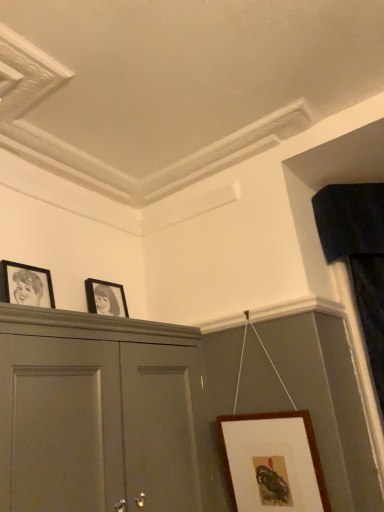
Question: From the image's perspective, relative to brown wooden picture frame at lower right, which is the first picture frame in right-to-left order, is matte gray cabinet at upper left above or below?

Choices:
 (A) below
 (B) above

Answer: (B)

Question: In terms of width, does matte gray cabinet at upper left look wider or thinner when compared to brown wooden picture frame at lower right, the third picture frame when ordered from top to bottom?

Choices:
 (A) wide
 (B) thin

Answer: (A)

Question: Considering the real-world distances, which object is closest to the brown wooden picture frame at lower right, which is the first picture frame in right-to-left order?

Choices:
 (A) matte gray cabinet at upper left
 (B) black matte picture frame at left, placed as the 3th picture frame when sorted from right to left
 (C) velvet dark blue curtain at right
 (D) matte black picture frame at upper center, which is the 2th picture frame in bottom-to-top order

Answer: (A)

Question: Which is nearer to the matte black picture frame at upper center, the second picture frame from the top?

Choices:
 (A) brown wooden picture frame at lower right, which is the first picture frame in right-to-left order
 (B) velvet dark blue curtain at right
 (C) black matte picture frame at left, which ranks as the third picture frame in bottom-to-top order
 (D) matte gray cabinet at upper left

Answer: (C)